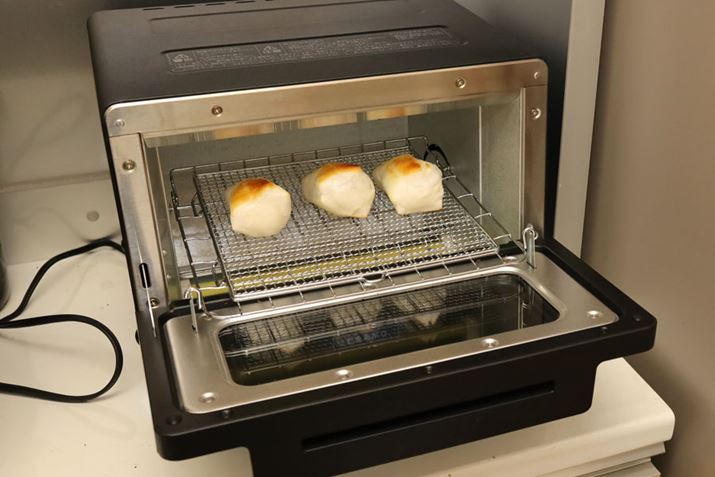
The width and height of the screenshot is (715, 477). Identify the location of cord. (91, 251), (44, 322), (29, 388).